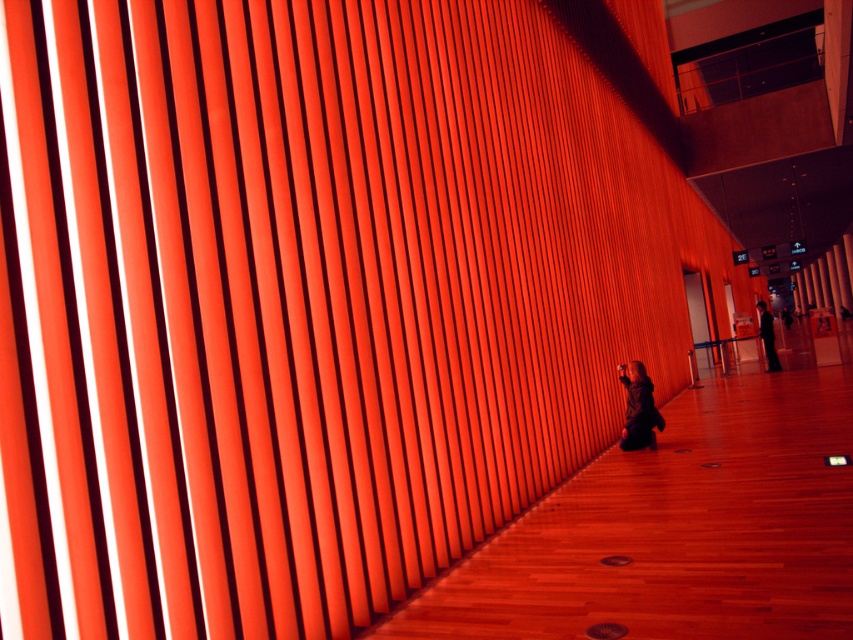
Can you confirm if matte black jacket at lower center is taller than dark suit at center?

No, matte black jacket at lower center is not taller than dark suit at center.

Can you confirm if matte black jacket at lower center is positioned below dark suit at center?

Yes, matte black jacket at lower center is below dark suit at center.

Is point (639, 368) behind point (764, 308)?

No, (639, 368) is closer to viewer.

The width and height of the screenshot is (853, 640). I want to click on matte black jacket at lower center, so click(x=639, y=410).